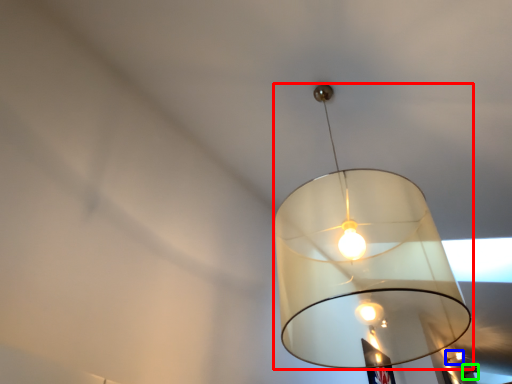
Question: Based on their relative distances, which object is farther from lamp (highlighted by a red box)? Choose from lamp (highlighted by a blue box) and lamp (highlighted by a green box).

Choices:
 (A) lamp
 (B) lamp

Answer: (B)